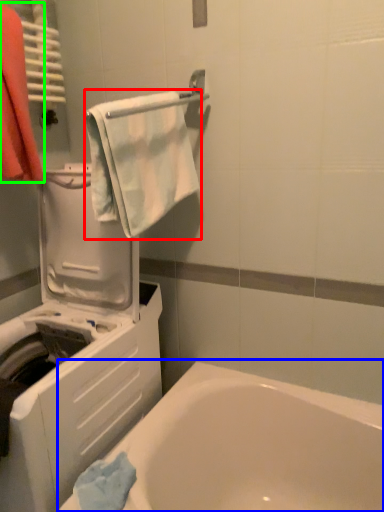
Question: Based on their relative distances, which object is farther from towel/napkin (highlighted by a red box)? Choose from bathtub (highlighted by a blue box) and laundry (highlighted by a green box).

Choices:
 (A) bathtub
 (B) laundry

Answer: (A)